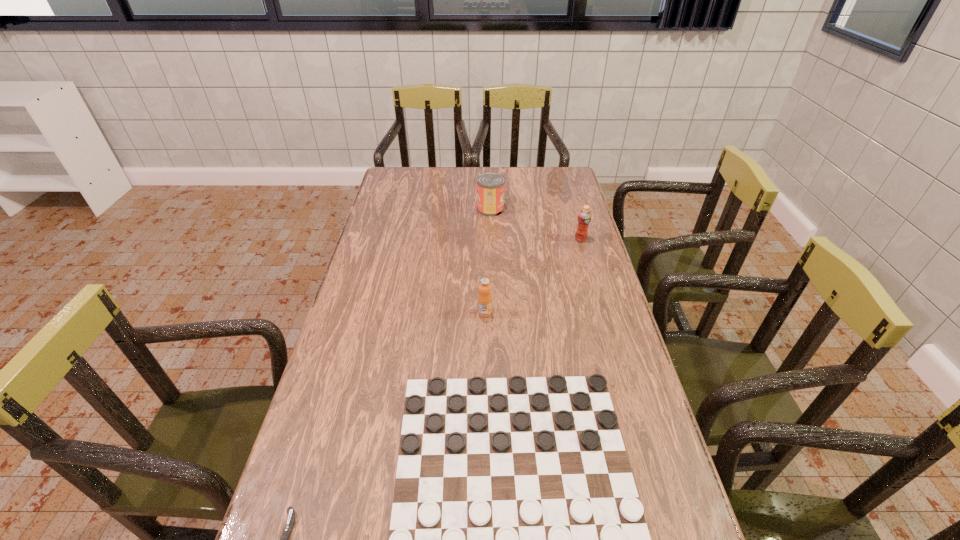
You are a GUI agent. You are given a task and a screenshot of the screen. Output one action in this format:
    pyautogui.click(x=<x>, y=<y>)
    Task: Click on the blank space at the left edge of the desktop
    
    Given the screenshot: What is the action you would take?
    pyautogui.click(x=397, y=195)

Find the location of `vacant space at the right edge`. vacant space at the right edge is located at coordinates (552, 226).

Image resolution: width=960 pixels, height=540 pixels. I want to click on free space at the far left corner of the desktop, so click(398, 170).

This screenshot has width=960, height=540. I want to click on blank area at the far right corner, so click(x=556, y=168).

You are a GUI agent. You are given a task and a screenshot of the screen. Output one action in this format:
    pyautogui.click(x=<x>, y=<y>)
    Task: Click on the empty space that is in between the fourth nearest object and the can
    This screenshot has width=960, height=540.
    Given the screenshot: What is the action you would take?
    pyautogui.click(x=536, y=224)

Locate an element on the screen. empty location between the farther orange juice and the can is located at coordinates (536, 224).

Find the location of a particular element. vacant space that is in between the rightmost object and the farthest object is located at coordinates (536, 224).

Find the location of a particular element. object that is the second nearest to the gameboard is located at coordinates point(484,298).

This screenshot has width=960, height=540. Identify the location of object that stands as the fourth closest to the right orange juice. (287, 530).